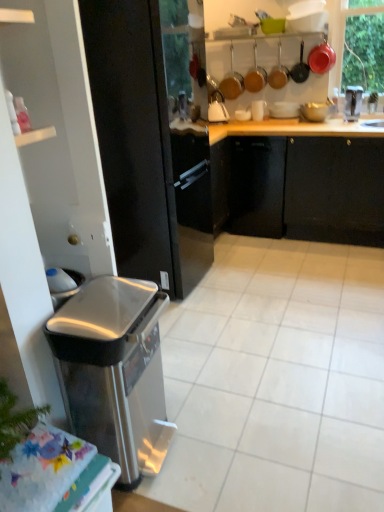
The image size is (384, 512). I want to click on vacant point above stainless steel trash can at lower left (from a real-world perspective), so click(x=96, y=308).